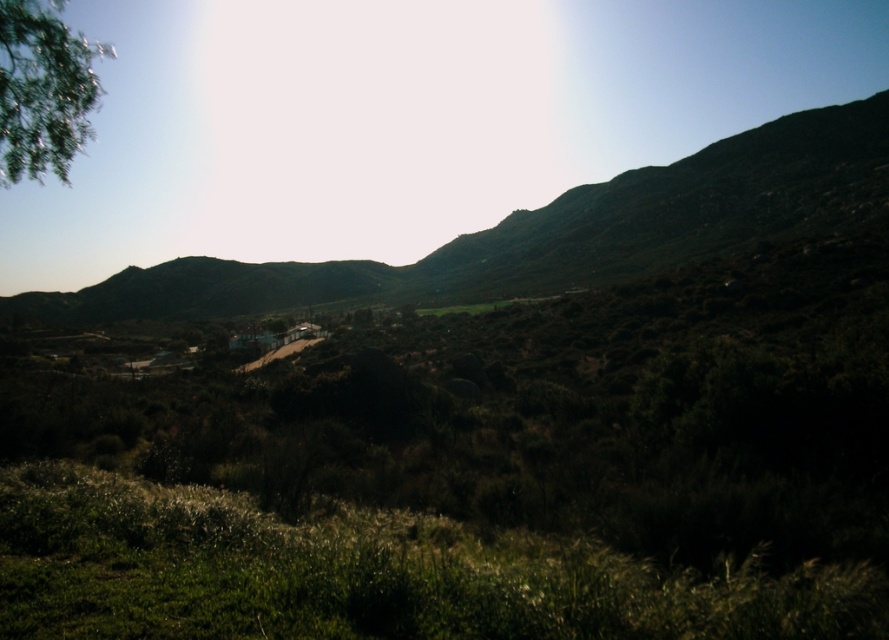
Is point (785, 163) behind point (25, 49)?

Yes.

Between green grassy hill at center and green leafy tree at upper left, which one is positioned lower?

Positioned lower is green leafy tree at upper left.

The height and width of the screenshot is (640, 889). What do you see at coordinates (550, 230) in the screenshot?
I see `green grassy hill at center` at bounding box center [550, 230].

The image size is (889, 640). In order to click on green grassy hill at center in this screenshot , I will do `click(550, 230)`.